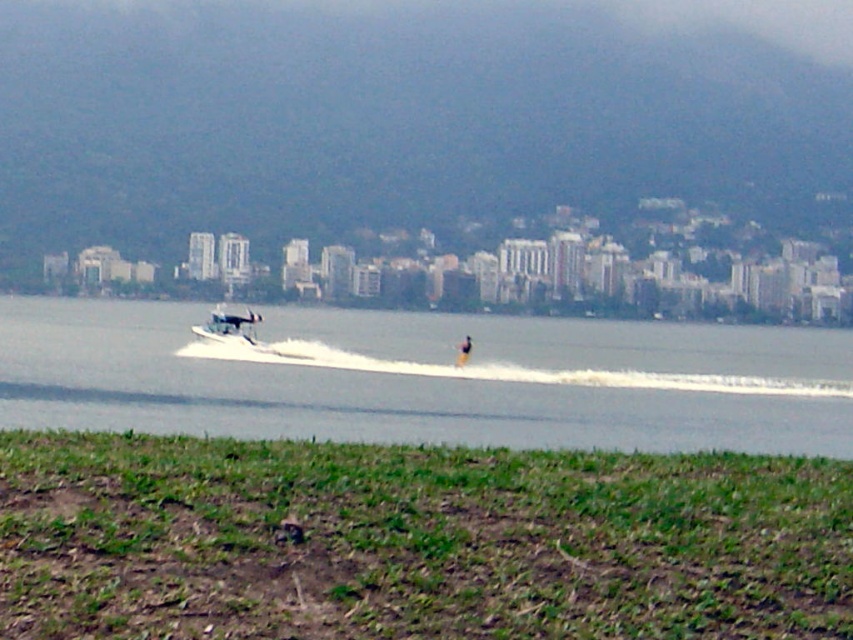
Between clear water at center and white matte boat at center, which one is positioned higher?

white matte boat at center is above.

Which is in front, point (766, 433) or point (251, 317)?

Point (766, 433) is in front.

Locate an element on the screen. clear water at center is located at coordinates (428, 378).

Can you confirm if clear water at center is bigger than yellow fabric person at center?

Correct, clear water at center is larger in size than yellow fabric person at center.

Does clear water at center appear on the right side of yellow fabric person at center?

In fact, clear water at center is to the left of yellow fabric person at center.

Does point (374, 410) lie behind point (457, 358)?

That is False.

The height and width of the screenshot is (640, 853). Identify the location of clear water at center. (428, 378).

Which is more to the right, white matte boat at center or yellow fabric person at center?

From the viewer's perspective, yellow fabric person at center appears more on the right side.

Who is more forward, (207, 339) or (457, 365)?

Point (457, 365)

Locate an element on the screen. white matte boat at center is located at coordinates [x=231, y=330].